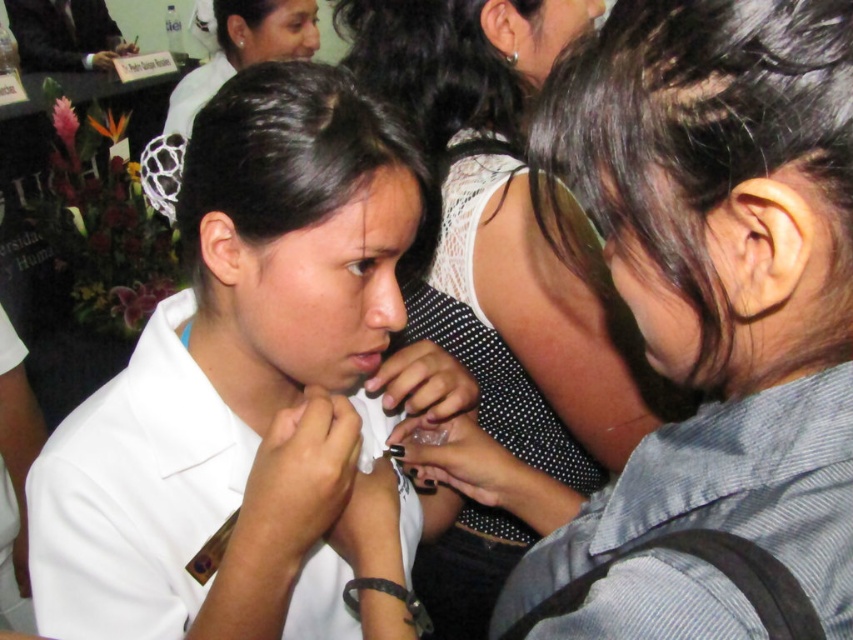
Question: Can you confirm if white uniform shirt at center is positioned above white dotted dress at center?

Choices:
 (A) yes
 (B) no

Answer: (A)

Question: Does white dotted dress at center have a smaller size compared to white uniform at upper center?

Choices:
 (A) no
 (B) yes

Answer: (A)

Question: Among these objects, which one is nearest to the camera?

Choices:
 (A) white uniform at upper center
 (B) white uniform shirt at center
 (C) white dotted dress at center

Answer: (C)

Question: Which object appears farthest from the camera in this image?

Choices:
 (A) white dotted dress at center
 (B) white uniform at upper center
 (C) white uniform shirt at center

Answer: (B)

Question: Which point is closer to the camera?

Choices:
 (A) (286, 17)
 (B) (509, 221)

Answer: (B)

Question: Does white uniform shirt at center appear under white uniform at upper center?

Choices:
 (A) yes
 (B) no

Answer: (A)